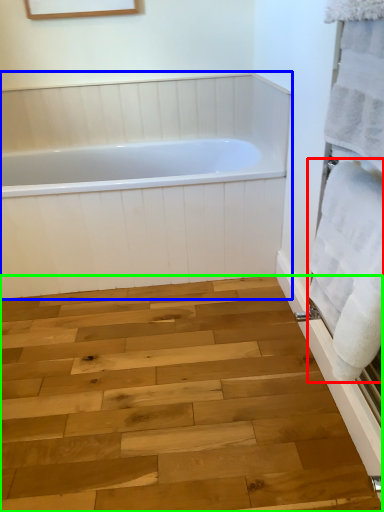
Question: Considering the real-world distances, which object is closest to bath towel (highlighted by a red box)? bathtub (highlighted by a blue box) or plank (highlighted by a green box).

Choices:
 (A) bathtub
 (B) plank

Answer: (B)